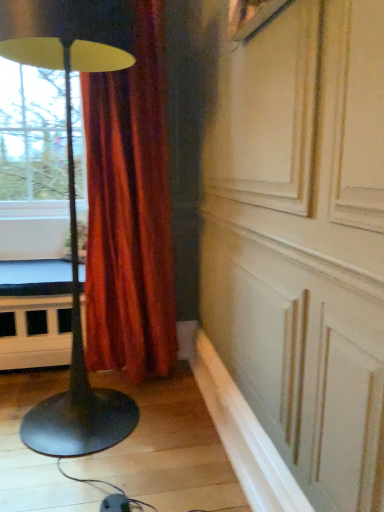
Identify the location of free location in front of black matte floor lamp at left. (88, 482).